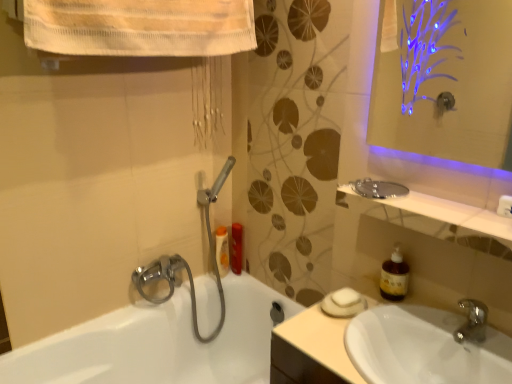
In order to click on orange glossy lotion at upper left, the second toiletry when ordered from right to left in this screenshot , I will do `click(222, 250)`.

The image size is (512, 384). I want to click on white matte soap at sink, so click(x=345, y=297).

From the image's perspective, is white glossy sink at lower right beneath white glossy bathtub at lower left?

No.

From a real-world perspective, is white glossy sink at lower right physically located above or below white glossy bathtub at lower left?

white glossy sink at lower right is situated higher than white glossy bathtub at lower left in the real world.

Is white glossy sink at lower right located outside white glossy bathtub at lower left?

white glossy sink at lower right is positioned outside white glossy bathtub at lower left.

Considering the sizes of objects white glossy sink at lower right and white glossy bathtub at lower left in the image provided, who is bigger, white glossy sink at lower right or white glossy bathtub at lower left?

white glossy bathtub at lower left.

Which is in front, orange glossy lotion at upper left, placed as the first toiletry when sorted from left to right, or clear glass mirror at upper right?

clear glass mirror at upper right is in front.

Is orange glossy lotion at upper left, the second toiletry when ordered from right to left, completely or partially outside of clear glass mirror at upper right?

Yes, orange glossy lotion at upper left, the second toiletry when ordered from right to left, is not within clear glass mirror at upper right.

Identify the location of balustrade in front of the orange glossy lotion at upper left, the second toiletry when ordered from right to left. (438, 219).

Does orange glossy lotion at upper left, the second toiletry when ordered from right to left, touch clear glass mirror at upper right?

No, orange glossy lotion at upper left, the second toiletry when ordered from right to left, is not touching clear glass mirror at upper right.

The height and width of the screenshot is (384, 512). There is a white glossy sink at lower right. In order to click on balustrade above it (from a real-world perspective) in this screenshot , I will do `click(438, 219)`.

Which is nearer, (507, 248) or (459, 356)?

The point (507, 248) is more forward.

Is clear glass mirror at upper right in front of or behind white glossy sink at lower right in the image?

clear glass mirror at upper right is positioned farther from the viewer than white glossy sink at lower right.

In terms of width, does clear glass mirror at upper right look wider or thinner when compared to white glossy sink at lower right?

clear glass mirror at upper right is thinner than white glossy sink at lower right.

How many degrees apart are the facing directions of white glossy sink at lower right and white matte soap at sink?

9.12e-06 degrees.

Is white glossy sink at lower right to the right of white matte soap at sink from the viewer's perspective?

Correct, you'll find white glossy sink at lower right to the right of white matte soap at sink.

In the scene shown: Is white glossy sink at lower right oriented away from white matte soap at sink?

That's not correct — white glossy sink at lower right is not looking away from white matte soap at sink.

Do you think white glossy sink at lower right is within white matte soap at sink, or outside of it?

white glossy sink at lower right is located beyond the bounds of white matte soap at sink.

Is matte plastic bottle at center, marked as the second toiletry in a left-to-right arrangement, smaller than clear glass mirror at upper right?

Yes, matte plastic bottle at center, marked as the second toiletry in a left-to-right arrangement, is smaller than clear glass mirror at upper right.

Considering the sizes of matte plastic bottle at center, marked as the second toiletry in a left-to-right arrangement, and clear glass mirror at upper right in the image, is matte plastic bottle at center, marked as the second toiletry in a left-to-right arrangement, wider or thinner than clear glass mirror at upper right?

matte plastic bottle at center, marked as the second toiletry in a left-to-right arrangement, is thinner than clear glass mirror at upper right.

Which point is more distant from viewer, (236, 264) or (411, 194)?

The point (236, 264) is behind.

Considering the relative sizes of matte plastic bottle at center, the first toiletry when ordered from right to left, and clear glass mirror at upper right in the image provided, is matte plastic bottle at center, the first toiletry when ordered from right to left, taller than clear glass mirror at upper right?

Indeed, matte plastic bottle at center, the first toiletry when ordered from right to left, has a greater height compared to clear glass mirror at upper right.

Which point is more distant from viewer, [353,302] or [391,255]?

The point [391,255] is farther from the camera.

From the picture: Between white matte soap at sink and brown translucent soap dispenser at right, which one has less height?

With less height is white matte soap at sink.

Which object is further away from the camera, white matte soap at sink or brown translucent soap dispenser at right?

brown translucent soap dispenser at right is more distant.

Considering the points (231, 266) and (139, 331), which point is behind, point (231, 266) or point (139, 331)?

The point (231, 266) is more distant.

Does matte plastic bottle at center, the first toiletry when ordered from right to left, lie behind white glossy bathtub at lower left?

Yes, matte plastic bottle at center, the first toiletry when ordered from right to left, is further from the viewer.

Looking at their sizes, would you say matte plastic bottle at center, marked as the second toiletry in a left-to-right arrangement, is wider or thinner than white glossy bathtub at lower left?

matte plastic bottle at center, marked as the second toiletry in a left-to-right arrangement, is thinner than white glossy bathtub at lower left.

Based on the photo, visually, is matte plastic bottle at center, marked as the second toiletry in a left-to-right arrangement, positioned to the left or to the right of white glossy bathtub at lower left?

matte plastic bottle at center, marked as the second toiletry in a left-to-right arrangement, is to the right of white glossy bathtub at lower left.

This screenshot has width=512, height=384. Find the location of `sink on the right of white glossy bathtub at lower left`. sink on the right of white glossy bathtub at lower left is located at coordinates (423, 348).

This screenshot has height=384, width=512. In order to click on balustrade positioned vertically above the orange glossy lotion at upper left, placed as the first toiletry when sorted from left to right (from a real-world perspective) in this screenshot , I will do pyautogui.click(x=438, y=219).

Estimate the real-world distances between objects in this image. Which object is further from clear glass mirror at upper right, white glossy sink at lower right or matte plastic bottle at center, marked as the second toiletry in a left-to-right arrangement?

Among the two, matte plastic bottle at center, marked as the second toiletry in a left-to-right arrangement, is located further to clear glass mirror at upper right.

Estimate the real-world distances between objects in this image. Which object is further from white matte soap at sink, white glossy bathtub at lower left or brown translucent soap dispenser at right?

white glossy bathtub at lower left.

Looking at the image, which one is located closer to brown translucent soap dispenser at right, orange glossy lotion at upper left, placed as the first toiletry when sorted from left to right, or white matte soap at sink?

Based on the image, white matte soap at sink appears to be nearer to brown translucent soap dispenser at right.

Considering their positions, is brown translucent soap dispenser at right positioned further to matte plastic bottle at center, the first toiletry when ordered from right to left, than white matte soap at sink?

Based on the image, brown translucent soap dispenser at right appears to be further to matte plastic bottle at center, the first toiletry when ordered from right to left.

Estimate the real-world distances between objects in this image. Which object is closer to white glossy bathtub at lower left, orange glossy lotion at upper left, the second toiletry when ordered from right to left, or white matte soap at sink?

Among the two, orange glossy lotion at upper left, the second toiletry when ordered from right to left, is located nearer to white glossy bathtub at lower left.

Based on their spatial positions, is white matte soap at sink or white glossy bathtub at lower left closer to orange glossy lotion at upper left, the second toiletry when ordered from right to left?

Based on the image, white glossy bathtub at lower left appears to be nearer to orange glossy lotion at upper left, the second toiletry when ordered from right to left.

Estimate the real-world distances between objects in this image. Which object is closer to brown translucent soap dispenser at right, matte plastic bottle at center, marked as the second toiletry in a left-to-right arrangement, or white glossy bathtub at lower left?

Based on the image, matte plastic bottle at center, marked as the second toiletry in a left-to-right arrangement, appears to be nearer to brown translucent soap dispenser at right.

Based on their spatial positions, is clear glass mirror at upper right or white glossy sink at lower right closer to brown translucent soap dispenser at right?

Among the two, white glossy sink at lower right is located nearer to brown translucent soap dispenser at right.

Locate an element on the screen. This screenshot has height=384, width=512. balustrade between white glossy bathtub at lower left and orange glossy lotion at upper left, placed as the first toiletry when sorted from left to right, in the front-back direction is located at coordinates (438, 219).

Where is `sink between white glossy bathtub at lower left and clear glass mirror at upper right`? Image resolution: width=512 pixels, height=384 pixels. sink between white glossy bathtub at lower left and clear glass mirror at upper right is located at coordinates (423, 348).

At what (x,y) coordinates should I click in order to perform the action: click on soap between white glossy bathtub at lower left and orange glossy lotion at upper left, the second toiletry when ordered from right to left, along the z-axis. Please return your answer as a coordinate pair (x, y). This screenshot has height=384, width=512. Looking at the image, I should click on (345, 297).

Identify the location of soap dispenser positioned between white glossy bathtub at lower left and matte plastic bottle at center, the first toiletry when ordered from right to left, from near to far. (394, 276).